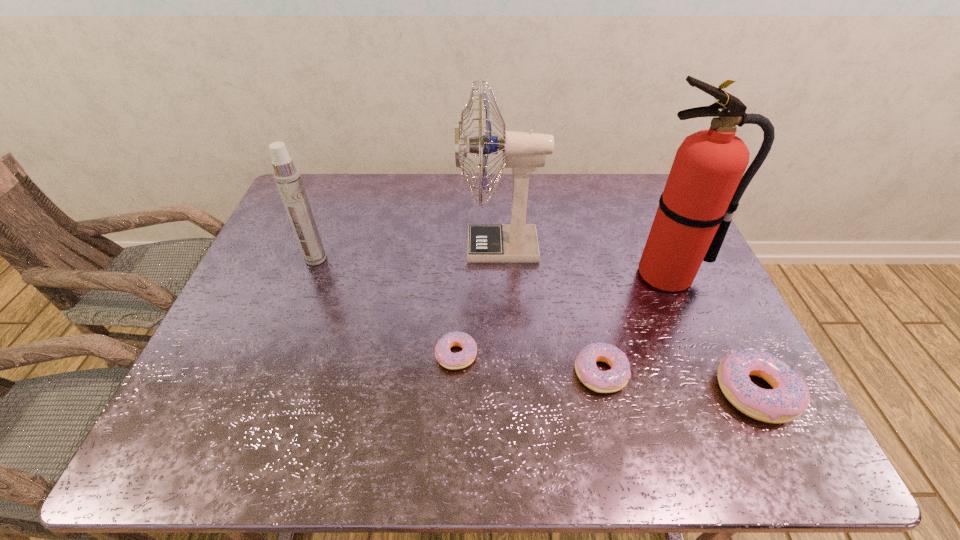
This screenshot has width=960, height=540. Identify the location of vacant space that satisfies the following two spatial constraints: 1. on the front side of the rightmost doughnut; 2. on the left side of the second shortest doughnut. 605,392.

Identify the location of free space that satisfies the following two spatial constraints: 1. on the front-facing side of the fan; 2. on the front side of the shortest doughnut. This screenshot has width=960, height=540. (505, 355).

Image resolution: width=960 pixels, height=540 pixels. I want to click on vacant region that satisfies the following two spatial constraints: 1. on the front-facing side of the fan; 2. on the front side of the leftmost object, so click(x=500, y=259).

The image size is (960, 540). Identify the location of vacant space that satisfies the following two spatial constraints: 1. at the nozzle of the fourth tallest object; 2. on the right side of the fire extinguisher. (716, 392).